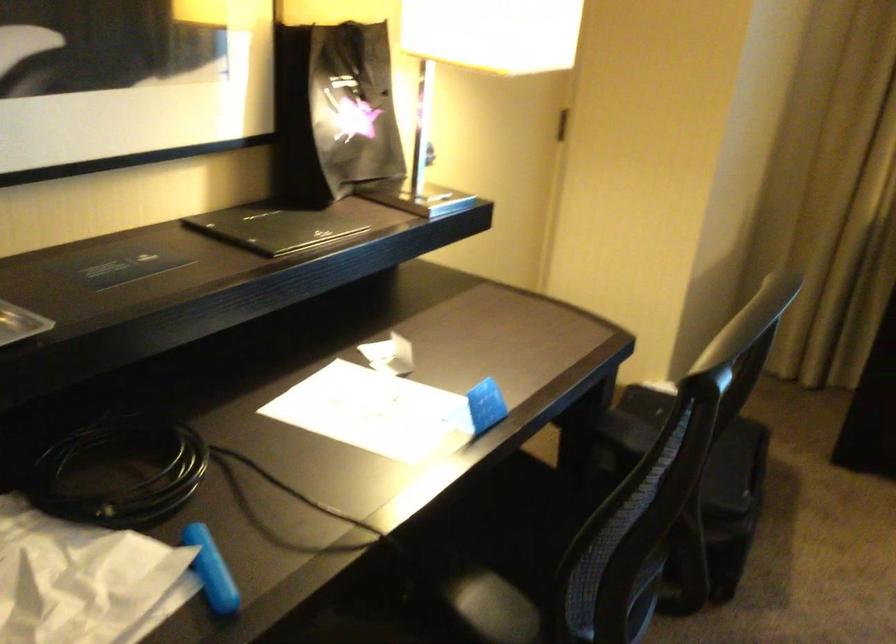
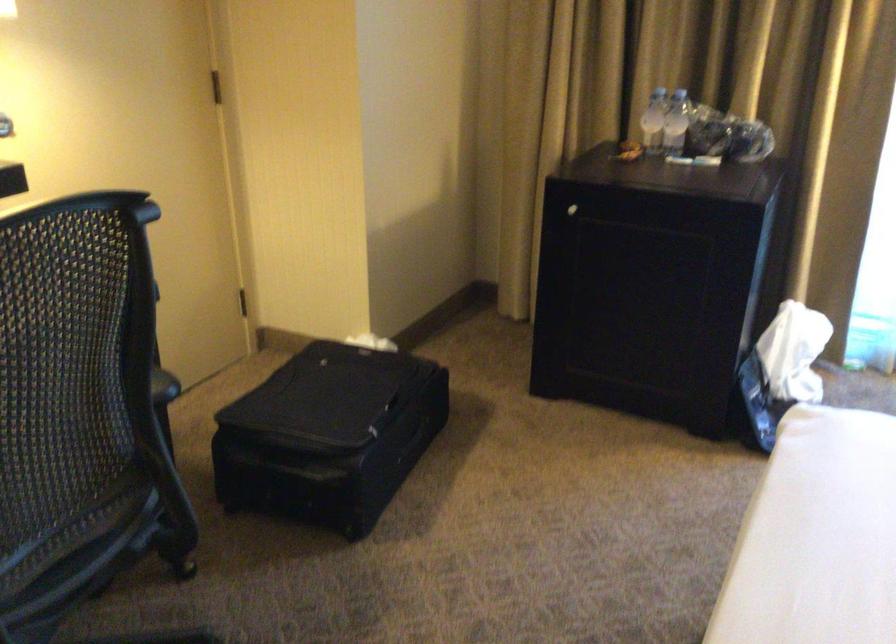
Where in the second image is the point corresponding to point (709, 491) from the first image?

(329, 436)